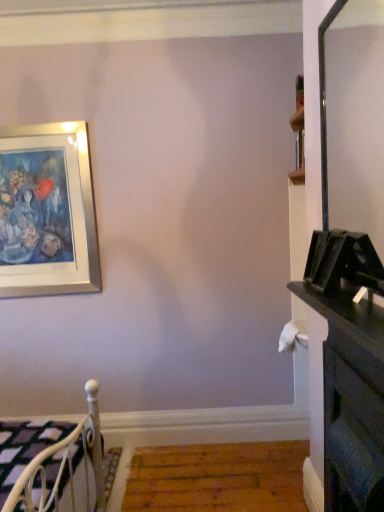
Question: Does point (352, 380) appear closer or farther from the camera than point (72, 481)?

Choices:
 (A) farther
 (B) closer

Answer: (B)

Question: Is black glossy dresser at lower right bigger or smaller than white metal bed at lower left?

Choices:
 (A) big
 (B) small

Answer: (B)

Question: In terms of height, does black glossy dresser at lower right look taller or shorter compared to white metal bed at lower left?

Choices:
 (A) short
 (B) tall

Answer: (B)

Question: From the image's perspective, relative to black glossy dresser at lower right, is white metal bed at lower left above or below?

Choices:
 (A) above
 (B) below

Answer: (B)

Question: Choose the correct answer: Is white metal bed at lower left inside black glossy dresser at lower right or outside it?

Choices:
 (A) outside
 (B) inside

Answer: (A)

Question: Relative to black glossy dresser at lower right, is white metal bed at lower left in front or behind?

Choices:
 (A) front
 (B) behind

Answer: (B)

Question: Is point (91, 432) closer or farther from the camera than point (334, 313)?

Choices:
 (A) farther
 (B) closer

Answer: (A)